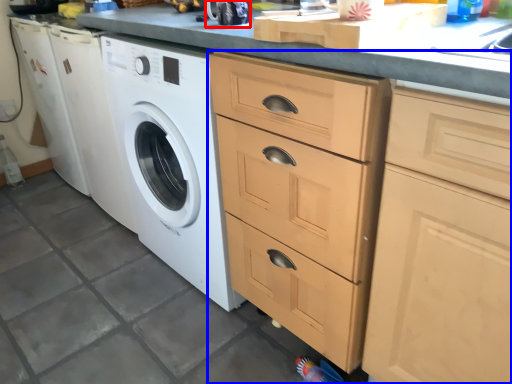
Question: Which object appears closest to the camera in this image, appliance (highlighted by a red box) or cabinetry (highlighted by a blue box)?

Choices:
 (A) appliance
 (B) cabinetry

Answer: (B)